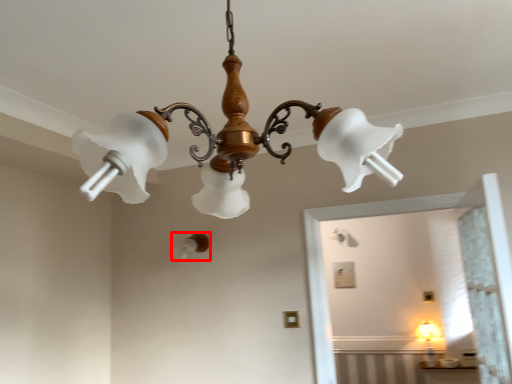
Question: From the image's perspective, where is lamp (annotated by the red box) located relative to lamp?

Choices:
 (A) above
 (B) below

Answer: (B)